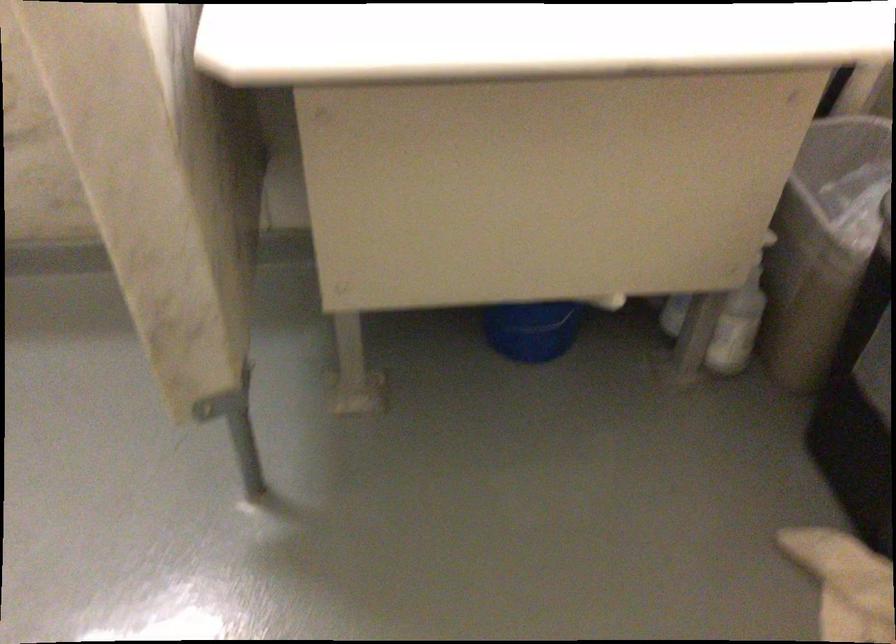
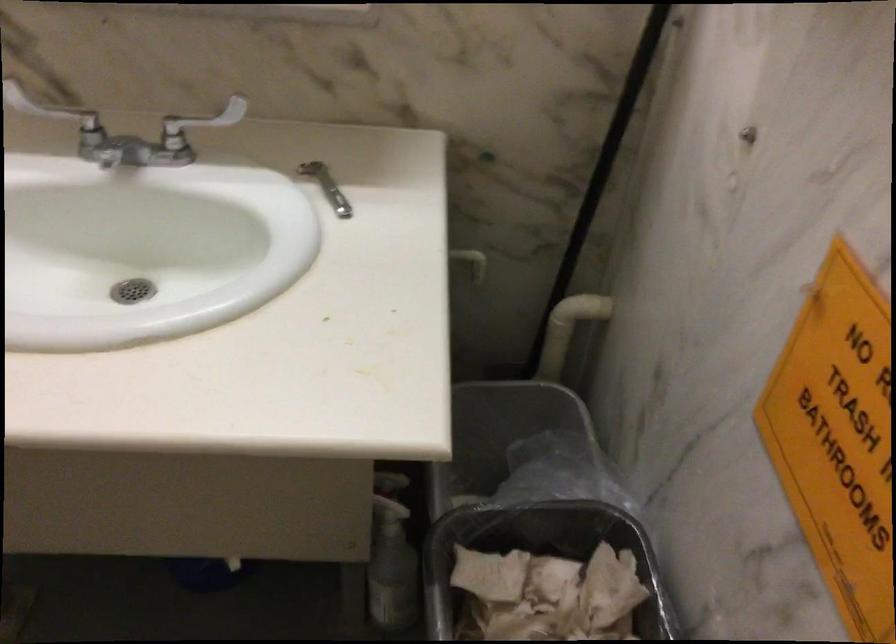
Question: In a continuous first-person perspective shot, in which direction is the camera moving?

Choices:
 (A) Left
 (B) Right
 (C) Forward
 (D) Backward

Answer: (B)